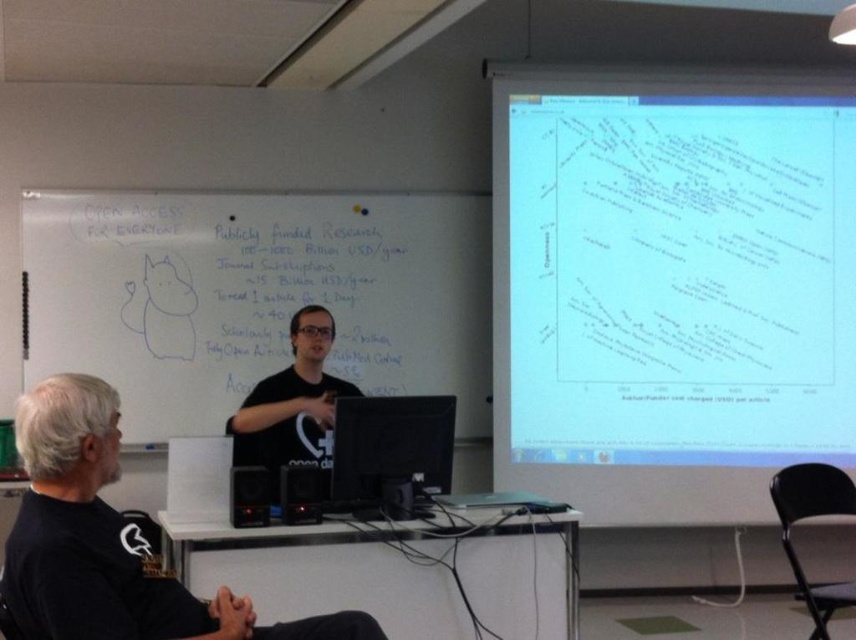
From the picture: You are organizing a large group presentation and need to choose between the white matte projector screen at upper right and the whiteboard at upper left. Based on their sizes, which one can accommodate more content horizontally?

The whiteboard at upper left can accommodate more content horizontally since its width is greater than the white matte projector screen at upper right.